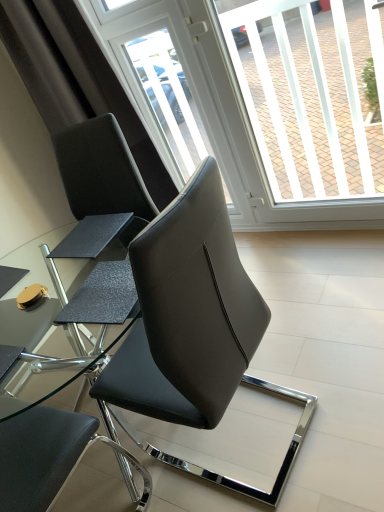
Question: Is matte black chair at center, marked as the third chair in a front-to-back arrangement, not near black leather chair at center, which is the third chair in back-to-front order?

Choices:
 (A) yes
 (B) no

Answer: (B)

Question: Does matte black chair at center, marked as the third chair in a front-to-back arrangement, appear on the right side of black leather chair at center, which is the third chair in back-to-front order?

Choices:
 (A) no
 (B) yes

Answer: (A)

Question: From the image's perspective, is matte black chair at center, the 1th chair positioned from the back, beneath black leather chair at center, which is the third chair in back-to-front order?

Choices:
 (A) yes
 (B) no

Answer: (B)

Question: Is matte black chair at center, marked as the third chair in a front-to-back arrangement, next to black leather chair at center, which is the third chair in back-to-front order, and touching it?

Choices:
 (A) yes
 (B) no

Answer: (B)

Question: Considering the relative sizes of matte black chair at center, marked as the third chair in a front-to-back arrangement, and black leather chair at center, which is the 1th chair from front to back, in the image provided, is matte black chair at center, marked as the third chair in a front-to-back arrangement, wider than black leather chair at center, which is the 1th chair from front to back,?

Choices:
 (A) yes
 (B) no

Answer: (B)

Question: Considering the positions of transparent glass window screen at upper center and black leather chair at center, which is the 2th chair in front-to-back order, in the image, is transparent glass window screen at upper center taller or shorter than black leather chair at center, which is the 2th chair in front-to-back order,?

Choices:
 (A) tall
 (B) short

Answer: (A)

Question: Is point (360, 57) positioned closer to the camera than point (112, 442)?

Choices:
 (A) farther
 (B) closer

Answer: (A)

Question: Looking at their shapes, would you say transparent glass window screen at upper center is wider or thinner than black leather chair at center, the 2th chair in the back-to-front sequence?

Choices:
 (A) wide
 (B) thin

Answer: (B)

Question: In the image, is transparent glass window screen at upper center on the left side or the right side of black leather chair at center, which is the 2th chair in front-to-back order?

Choices:
 (A) right
 (B) left

Answer: (A)

Question: Is transparent plastic screen door at upper center in front of or behind black leather chair at center, which is the third chair in back-to-front order, in the image?

Choices:
 (A) front
 (B) behind

Answer: (B)

Question: In the image, is transparent plastic screen door at upper center on the left side or the right side of black leather chair at center, which is the third chair in back-to-front order?

Choices:
 (A) left
 (B) right

Answer: (A)

Question: Does point (190, 125) appear closer or farther from the camera than point (130, 390)?

Choices:
 (A) farther
 (B) closer

Answer: (A)

Question: From the image's perspective, is transparent plastic screen door at upper center above or below black leather chair at center, which is the 1th chair from front to back?

Choices:
 (A) above
 (B) below

Answer: (A)

Question: From their relative heights in the image, would you say matte black chair at center, the 1th chair positioned from the back, is taller or shorter than black leather chair at center, the 2th chair in the back-to-front sequence?

Choices:
 (A) tall
 (B) short

Answer: (A)

Question: In terms of width, does matte black chair at center, the 1th chair positioned from the back, look wider or thinner when compared to black leather chair at center, the 2th chair in the back-to-front sequence?

Choices:
 (A) thin
 (B) wide

Answer: (B)